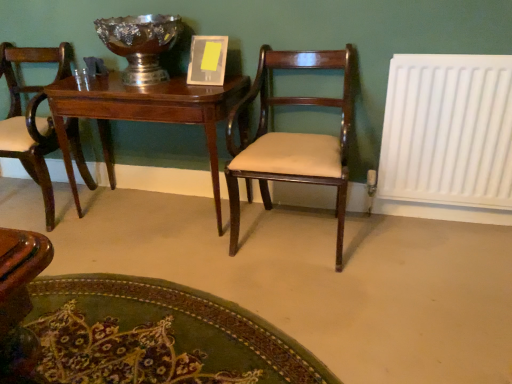
Identify the location of vacant space underneath mahogany wood chair at center, acting as the first chair starting from the right (from a real-world perspective). The image size is (512, 384). (290, 231).